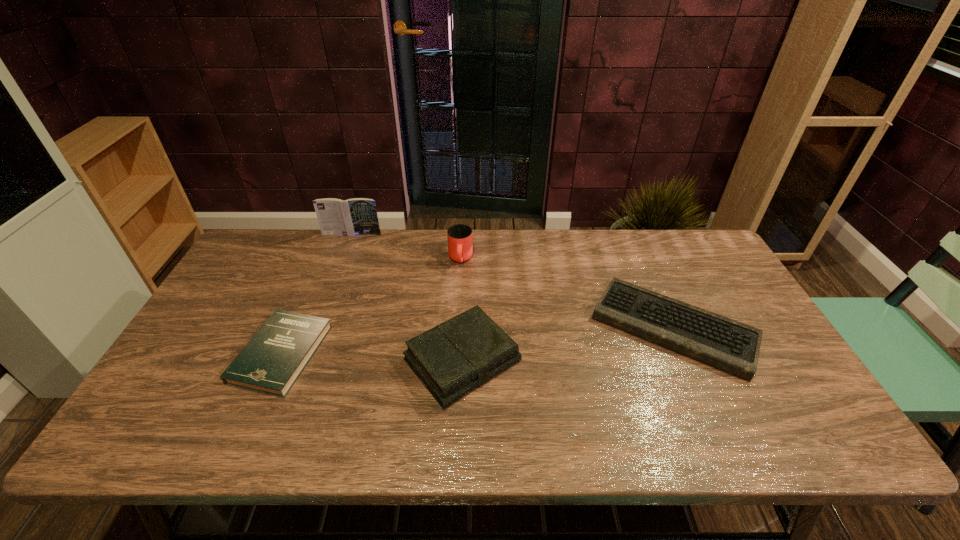
Identify the location of the tallest book. The image size is (960, 540). (358, 216).

The image size is (960, 540). What are the coordinates of `the farthest book` in the screenshot? It's located at (358, 216).

Locate an element on the screen. This screenshot has width=960, height=540. cup is located at coordinates (460, 247).

Image resolution: width=960 pixels, height=540 pixels. Find the location of `the second tallest object`. the second tallest object is located at coordinates (460, 247).

Where is `the second shortest book`? the second shortest book is located at coordinates (453, 358).

I want to click on the rightmost book, so click(x=453, y=358).

At what (x,y) coordinates should I click in order to perform the action: click on the fourth tallest object. Please return your answer as a coordinate pair (x, y). The width and height of the screenshot is (960, 540). Looking at the image, I should click on coord(721,342).

I want to click on computer keyboard, so click(x=721, y=342).

Where is `the shortest book`? This screenshot has height=540, width=960. the shortest book is located at coordinates (271, 362).

Identify the location of vacant area situated on the front cover of the farthest object. Image resolution: width=960 pixels, height=540 pixels. (337, 275).